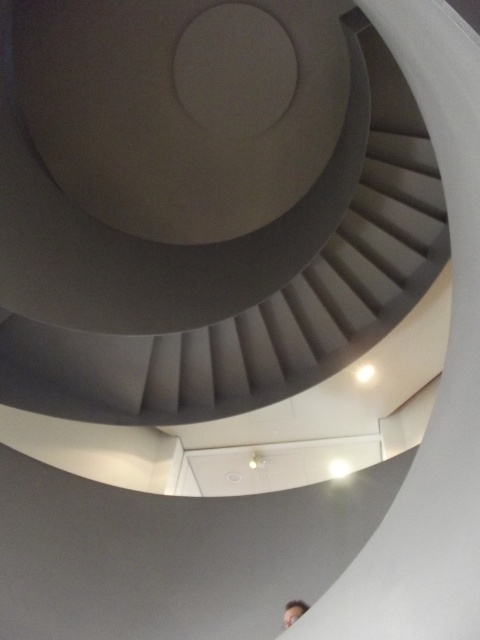
You are standing at the base of the spiral staircase and want to reach the top. Given that the smooth gray stairs at center are positioned at coordinates point 0.328, 0.417, can you estimate their location relative to the central axis of the staircase?

The smooth gray stairs at center are positioned at coordinates point (200, 209), which means they are slightly offset to the right and above the central axis of the staircase.

You are an architect designing a new building and want to ensure that the light brown hair at lower right can fit comfortably next to the smooth gray stairs at center. Based on the image, which object has a greater width?

The smooth gray stairs at center has a greater width than the light brown hair at lower right according to the description.